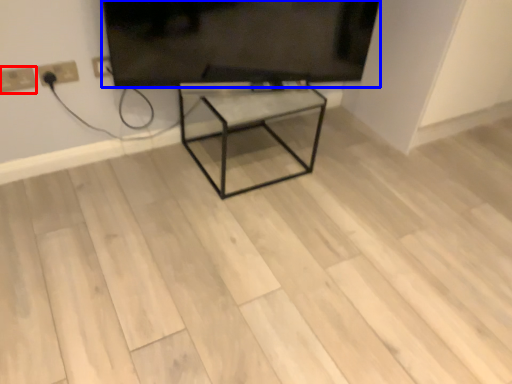
Question: Among these objects, which one is nearest to the camera, electric outlet (highlighted by a red box) or television (highlighted by a blue box)?

Choices:
 (A) electric outlet
 (B) television

Answer: (B)